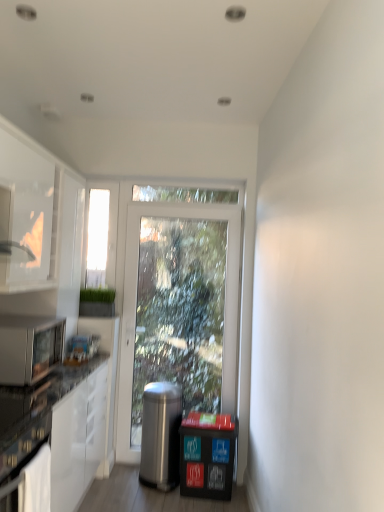
Question: From the image's perspective, is polished stainless steel trash can at center above or below black plastic recycling bin at lower right?

Choices:
 (A) above
 (B) below

Answer: (A)

Question: In the image, is polished stainless steel trash can at center on the left side or the right side of black plastic recycling bin at lower right?

Choices:
 (A) right
 (B) left

Answer: (B)

Question: Which object is the farthest from the transparent glass window screen at left?

Choices:
 (A) satin black microwave oven at lower left
 (B) black plastic recycling bin at lower right
 (C) polished stainless steel trash can at center
 (D) white glossy cabinet at left

Answer: (B)

Question: Which object is the farthest from the white glossy cabinet at left?

Choices:
 (A) satin black microwave oven at lower left
 (B) transparent glass window screen at left
 (C) polished stainless steel trash can at center
 (D) black plastic recycling bin at lower right

Answer: (D)